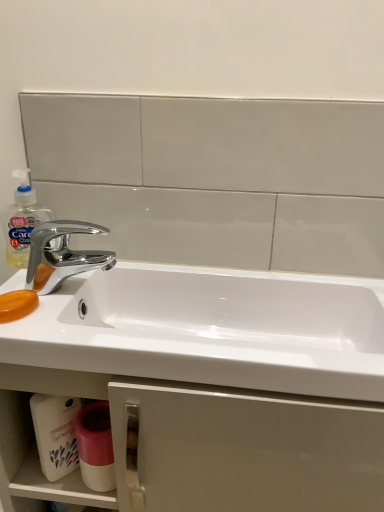
The width and height of the screenshot is (384, 512). In order to click on vacant area located to the right-hand side of orange translucent soap at left in this screenshot , I will do `click(118, 325)`.